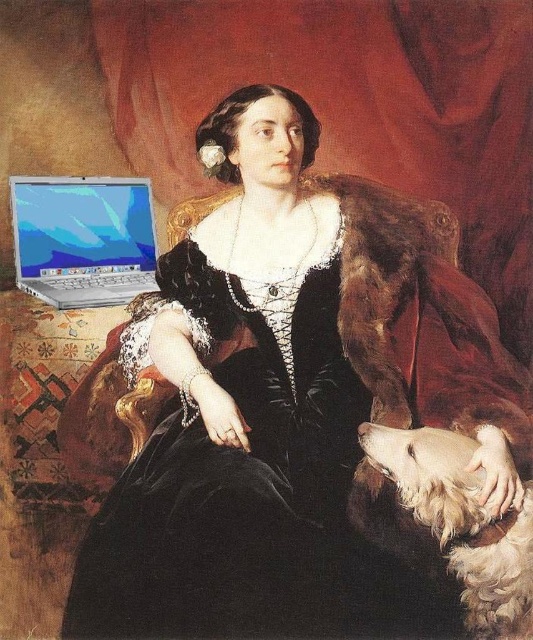
Is black velvet dress at center closer to the viewer compared to silver metallic laptop at lower left?

Yes, it is in front of silver metallic laptop at lower left.

Can you confirm if black velvet dress at center is bigger than silver metallic laptop at lower left?

Indeed, black velvet dress at center has a larger size compared to silver metallic laptop at lower left.

Between point (106, 365) and point (17, 212), which one is positioned in front?

Point (106, 365) is more forward.

Locate an element on the screen. The image size is (533, 640). black velvet dress at center is located at coordinates (236, 477).

Does white fluffy dog at lower right have a greater width compared to silver metallic laptop at lower left?

In fact, white fluffy dog at lower right might be narrower than silver metallic laptop at lower left.

Is white fluffy dog at lower right behind silver metallic laptop at lower left?

No, it is not.

Who is more forward, (458,513) or (126,248)?

Point (458,513) is more forward.

The height and width of the screenshot is (640, 533). I want to click on white fluffy dog at lower right, so click(462, 522).

What do you see at coordinates (236, 477) in the screenshot? The width and height of the screenshot is (533, 640). I see `black velvet dress at center` at bounding box center [236, 477].

What are the coordinates of `black velvet dress at center` in the screenshot? It's located at (236, 477).